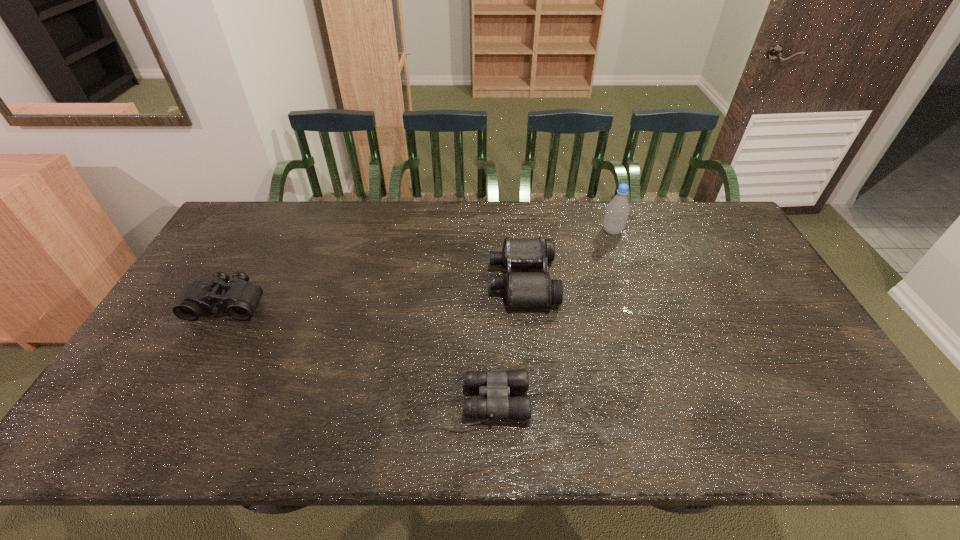
At what (x,y) coordinates should I click in order to perform the action: click on object that is at the left edge. Please return your answer as a coordinate pair (x, y). The image size is (960, 540). Looking at the image, I should click on (240, 298).

Where is `vacant space at the far edge of the desktop`? vacant space at the far edge of the desktop is located at coordinates (464, 226).

In the image, there is a desktop. Identify the location of blank space at the near edge. The image size is (960, 540). (721, 415).

In the image, there is a desktop. At what (x,y) coordinates should I click in order to perform the action: click on vacant area at the left edge. Please return your answer as a coordinate pair (x, y). Image resolution: width=960 pixels, height=540 pixels. Looking at the image, I should click on (209, 262).

Where is `vacant space at the right edge`? This screenshot has height=540, width=960. vacant space at the right edge is located at coordinates (710, 253).

This screenshot has width=960, height=540. I want to click on free space at the far left corner of the desktop, so click(x=254, y=225).

The height and width of the screenshot is (540, 960). In order to click on vacant space at the far right corner in this screenshot , I will do `click(712, 230)`.

Locate an element on the screen. The image size is (960, 540). unoccupied position between the bottle and the leftmost object is located at coordinates (420, 267).

This screenshot has height=540, width=960. What are the coordinates of `blank region between the bottle and the nearest object` in the screenshot? It's located at (540, 317).

Identify the location of vacant area between the nearest object and the leftmost binoculars. (347, 353).